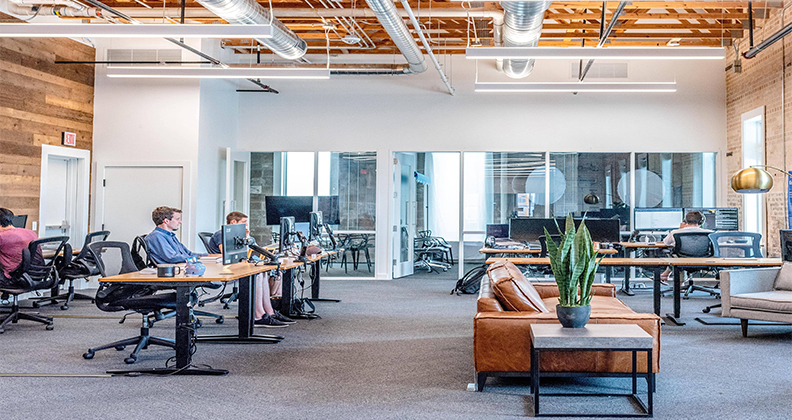
Identify the location of chair. The width and height of the screenshot is (792, 420). (33, 273), (84, 262), (105, 264), (141, 237), (206, 240), (687, 242), (755, 243), (439, 246), (447, 247), (360, 246).